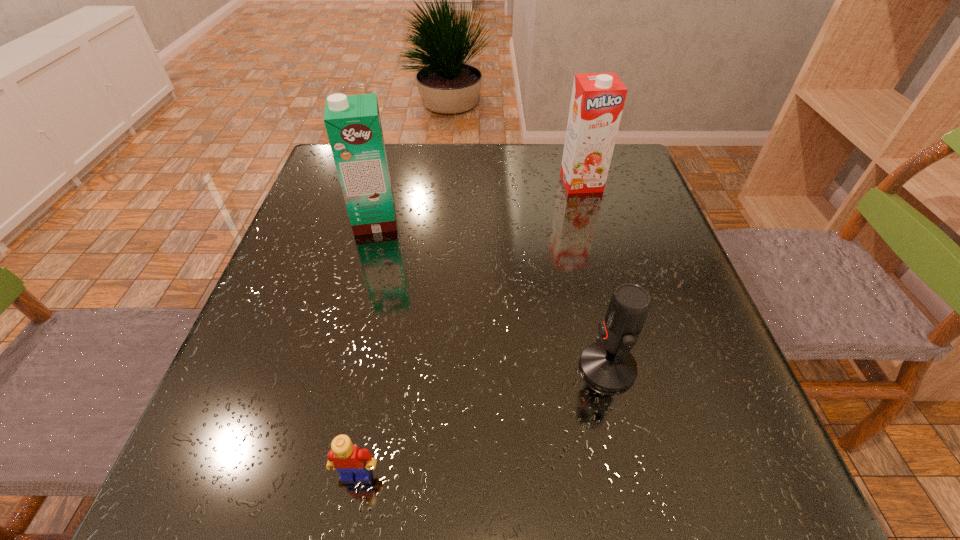
In the image, there is a desktop. At what (x,y) coordinates should I click in order to perform the action: click on vacant area at the near edge. Please return your answer as a coordinate pair (x, y). Image resolution: width=960 pixels, height=540 pixels. Looking at the image, I should click on (646, 488).

In the image, there is a desktop. Identify the location of vacant space at the left edge. This screenshot has height=540, width=960. (271, 354).

Where is `vacant space at the right edge of the desktop`? vacant space at the right edge of the desktop is located at coordinates (606, 223).

This screenshot has height=540, width=960. What are the coordinates of `blank space at the near left corner of the desktop` in the screenshot? It's located at (277, 470).

You are a GUI agent. You are given a task and a screenshot of the screen. Output one action in this format:
    pyautogui.click(x=<x>, y=<y>)
    Task: Click on the vacant space at the far right corner of the desktop
    This screenshot has width=960, height=540.
    Given the screenshot: What is the action you would take?
    pyautogui.click(x=624, y=188)

What are the coordinates of `vacant area at the near right corner` in the screenshot? It's located at (721, 487).

Identify the location of free area in between the left carton and the microphone. (492, 294).

At what (x,y) coordinates should I click in order to perform the action: click on empty location between the third tallest object and the nearer carton. Please return your answer as a coordinate pair (x, y). The height and width of the screenshot is (540, 960). Looking at the image, I should click on (492, 294).

Locate an element on the screen. vacant space that is in between the farther carton and the second nearest object is located at coordinates (594, 275).

At what (x,y) coordinates should I click in order to perform the action: click on free spot between the left carton and the nearest object. Please return your answer as a coordinate pair (x, y). The image size is (960, 540). Looking at the image, I should click on (366, 347).